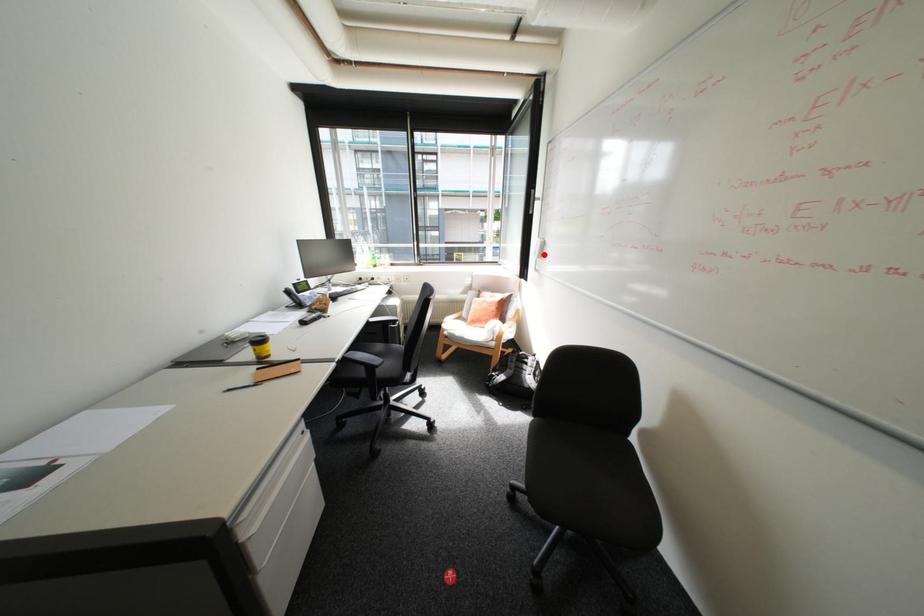
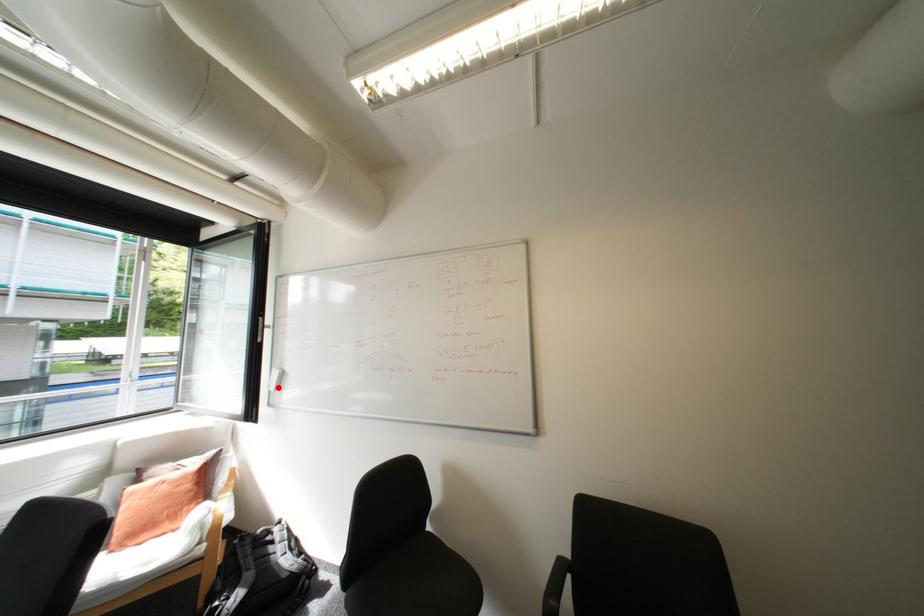
I am providing you with two images of the same scene from different viewpoints. A red point is marked on the first image and another point is marked on the second image. Is the red point in image1 aligned with the point shown in image2?

Yes